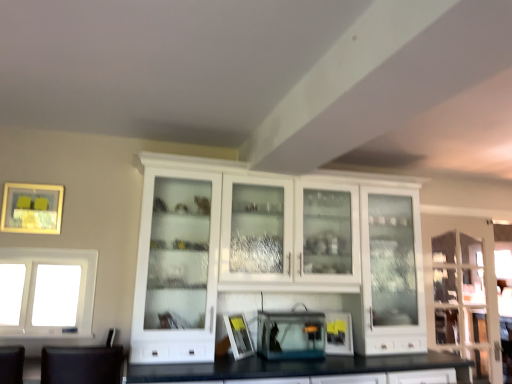
Question: Considering the relative positions of transparent plastic aquarium at center, placed as the 2th appliance when sorted from right to left, and white glass cabinet at center in the image provided, is transparent plastic aquarium at center, placed as the 2th appliance when sorted from right to left, to the right of white glass cabinet at center from the viewer's perspective?

Choices:
 (A) no
 (B) yes

Answer: (A)

Question: From the image's perspective, is transparent plastic aquarium at center, the 1th appliance when ordered from left to right, located above white glass cabinet at center?

Choices:
 (A) no
 (B) yes

Answer: (A)

Question: Is transparent plastic aquarium at center, placed as the 2th appliance when sorted from right to left, taller than white glass cabinet at center?

Choices:
 (A) yes
 (B) no

Answer: (B)

Question: Can you confirm if transparent plastic aquarium at center, the 1th appliance when ordered from left to right, is positioned to the left of white glass cabinet at center?

Choices:
 (A) yes
 (B) no

Answer: (A)

Question: Is transparent plastic aquarium at center, the 1th appliance when ordered from left to right, in front of white glass cabinet at center?

Choices:
 (A) yes
 (B) no

Answer: (B)

Question: Is point 34,190 closer or farther from the camera than point 27,271?

Choices:
 (A) farther
 (B) closer

Answer: (A)

Question: From the image's perspective, relative to white glass window at left, is matte gold picture frame at upper left, which is the second picture frame from right to left, above or below?

Choices:
 (A) below
 (B) above

Answer: (B)

Question: Considering their positions, is matte gold picture frame at upper left, placed as the 1th picture frame when sorted from left to right, located in front of or behind white glass window at left?

Choices:
 (A) front
 (B) behind

Answer: (B)

Question: From a real-world perspective, relative to white glass window at left, is matte gold picture frame at upper left, the first picture frame in the top-to-bottom sequence, vertically above or below?

Choices:
 (A) above
 (B) below

Answer: (A)

Question: In terms of width, does white glass window at left look wider or thinner when compared to white glass cabinet at center?

Choices:
 (A) wide
 (B) thin

Answer: (B)

Question: In terms of height, does white glass window at left look taller or shorter compared to white glass cabinet at center?

Choices:
 (A) short
 (B) tall

Answer: (A)

Question: In the image, is white glass window at left on the left side or the right side of white glass cabinet at center?

Choices:
 (A) right
 (B) left

Answer: (B)

Question: From the image's perspective, is white glass window at left positioned above or below white glass cabinet at center?

Choices:
 (A) below
 (B) above

Answer: (A)

Question: In the image, is white glass cabinet at center positioned in front of or behind matte gold picture frame at upper left, the first picture frame in the top-to-bottom sequence?

Choices:
 (A) front
 (B) behind

Answer: (A)

Question: Considering the positions of white glass cabinet at center and matte gold picture frame at upper left, the first picture frame in the top-to-bottom sequence, in the image, is white glass cabinet at center wider or thinner than matte gold picture frame at upper left, the first picture frame in the top-to-bottom sequence,?

Choices:
 (A) thin
 (B) wide

Answer: (B)